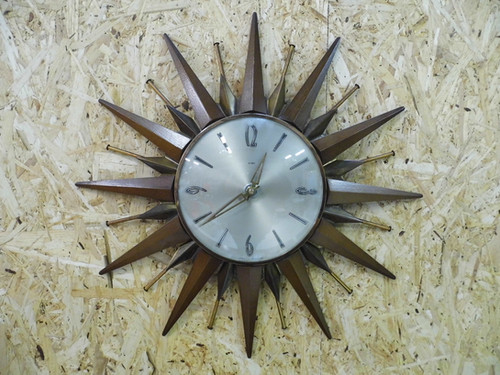
Image resolution: width=500 pixels, height=375 pixels. I want to click on black lines in wall, so click(x=107, y=245), click(x=149, y=358), click(x=38, y=351), click(x=9, y=270), click(x=410, y=90), click(x=464, y=108).